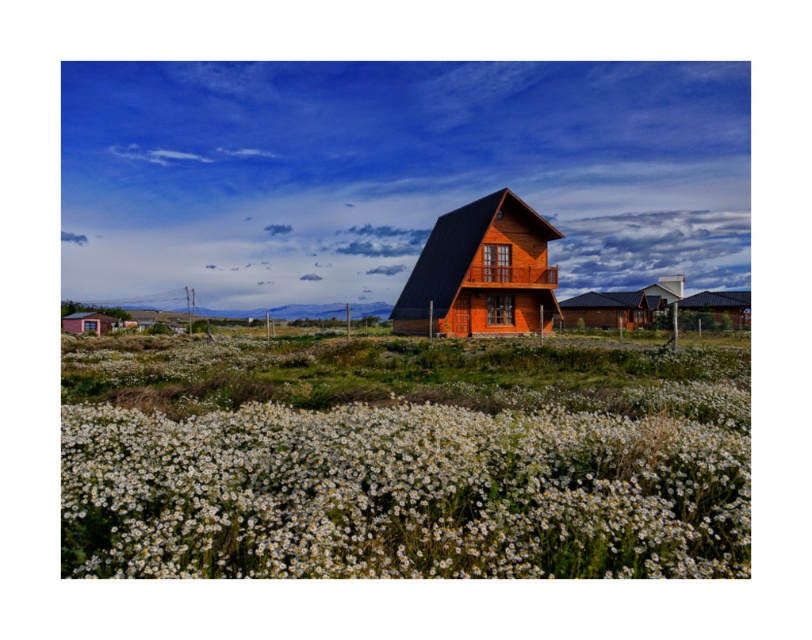
Is white fluffy petals at lower center positioned behind brown wooden hut at center?

No, it is not.

Does white fluffy petals at lower center have a lesser width compared to brown wooden hut at center?

Correct, white fluffy petals at lower center's width is less than brown wooden hut at center's.

Between point (610, 413) and point (611, 317), which one is positioned behind?

Point (611, 317)

Where is `white fluffy petals at lower center`? white fluffy petals at lower center is located at coordinates (400, 493).

Between wooden cabin at right and matte pink hut at lower left, which one has less height?

matte pink hut at lower left

Is wooden cabin at right thinner than matte pink hut at lower left?

In fact, wooden cabin at right might be wider than matte pink hut at lower left.

Which is behind, point (746, 305) or point (97, 314)?

The point (97, 314) is more distant.

You are a GUI agent. You are given a task and a screenshot of the screen. Output one action in this format:
    pyautogui.click(x=<x>, y=<y>)
    Task: Click on the wooden cabin at right
    This screenshot has height=640, width=812.
    Given the screenshot: What is the action you would take?
    pyautogui.click(x=715, y=308)

Can you confirm if matte wooden hut at center is taller than wooden cabin at right?

Yes, matte wooden hut at center is taller than wooden cabin at right.

Between matte wooden hut at center and wooden cabin at right, which one appears on the left side from the viewer's perspective?

matte wooden hut at center is more to the left.

Where is `matte wooden hut at center`? The width and height of the screenshot is (812, 640). matte wooden hut at center is located at coordinates (482, 273).